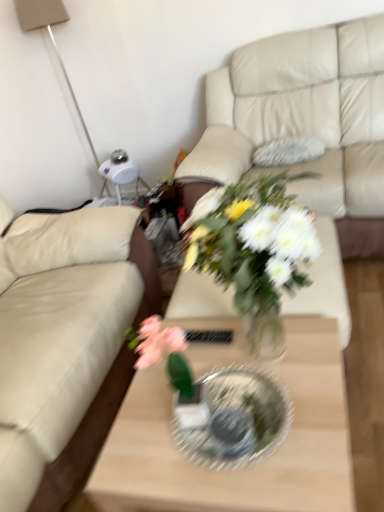
The width and height of the screenshot is (384, 512). In order to click on vacant area situated below translucent glass vase at center (from a real-world perspective) in this screenshot , I will do `click(287, 348)`.